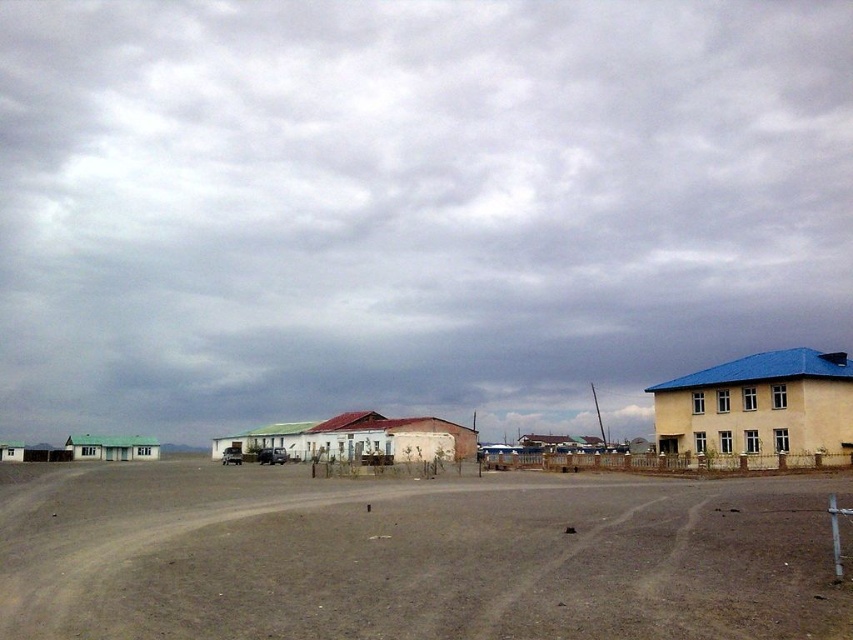
You are an astronaut stranded in a desert and need to locate the nearest shelter. You see the cloudy sky at upper center and the brown dirt field at lower center. Which object is larger in the scene?

The cloudy sky at upper center is bigger than the brown dirt field at lower center, so the cloudy sky at upper center is larger in the scene.

You are standing in the middle of the brown dirt field at lower center and want to look up at the cloudy sky at upper center. In which direction should you turn your head?

You should turn your head to the right to look at the cloudy sky at upper center since it is located to the right of the brown dirt field at lower center.